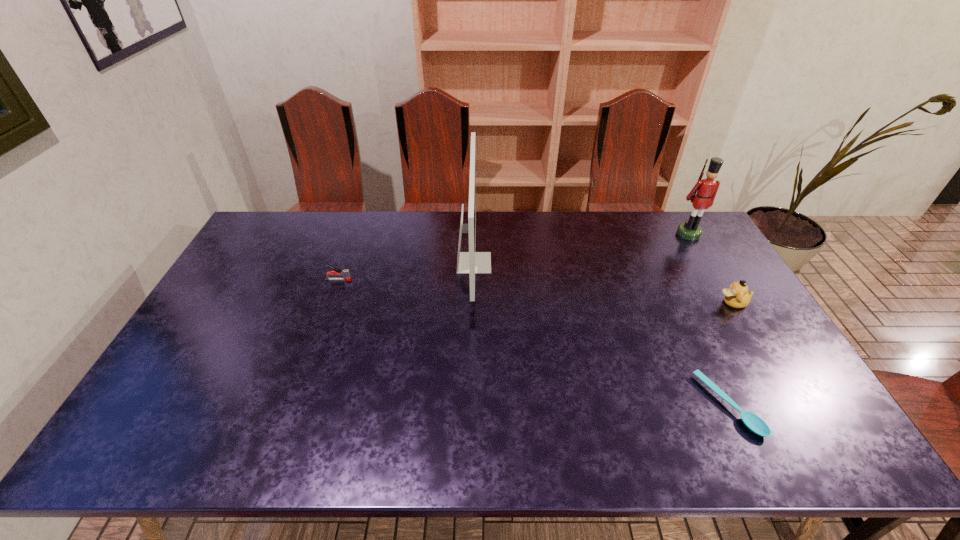
The height and width of the screenshot is (540, 960). I want to click on object at the far right corner, so click(706, 189).

This screenshot has height=540, width=960. In order to click on object that is at the near right corner in this screenshot , I will do `click(753, 422)`.

You are a GUI agent. You are given a task and a screenshot of the screen. Output one action in this format:
    pyautogui.click(x=<x>, y=<y>)
    Task: Click on the free space at the far edge of the desktop
    This screenshot has height=540, width=960.
    Given the screenshot: What is the action you would take?
    pyautogui.click(x=637, y=228)

Identify the location of free space at the near edge of the desktop. (636, 442).

In the image, there is a desktop. Where is `free space at the left edge`? free space at the left edge is located at coordinates (143, 414).

I want to click on free space at the right edge, so click(x=679, y=252).

In the image, there is a desktop. Identify the location of vacant space at the far left corner. (252, 246).

The height and width of the screenshot is (540, 960). Identify the location of vacant space at the near right corner of the desktop. (807, 425).

At what (x,y) coordinates should I click in order to perform the action: click on vacant space in between the duckling and the fourth object from right to left. Please return your answer as a coordinate pair (x, y). This screenshot has width=960, height=540. Looking at the image, I should click on (603, 283).

I want to click on free space between the leftmost object and the nutcracker, so click(514, 256).